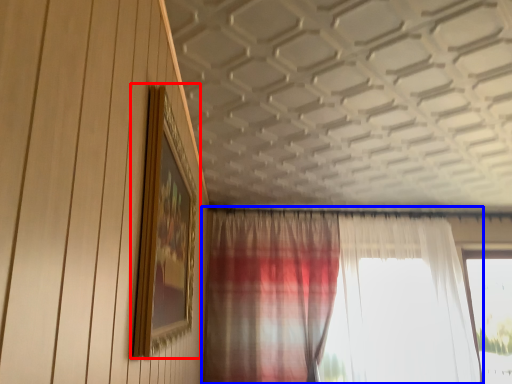
Question: Which object appears farthest to the camera in this image, picture frame (highlighted by a red box) or curtain (highlighted by a blue box)?

Choices:
 (A) picture frame
 (B) curtain

Answer: (B)